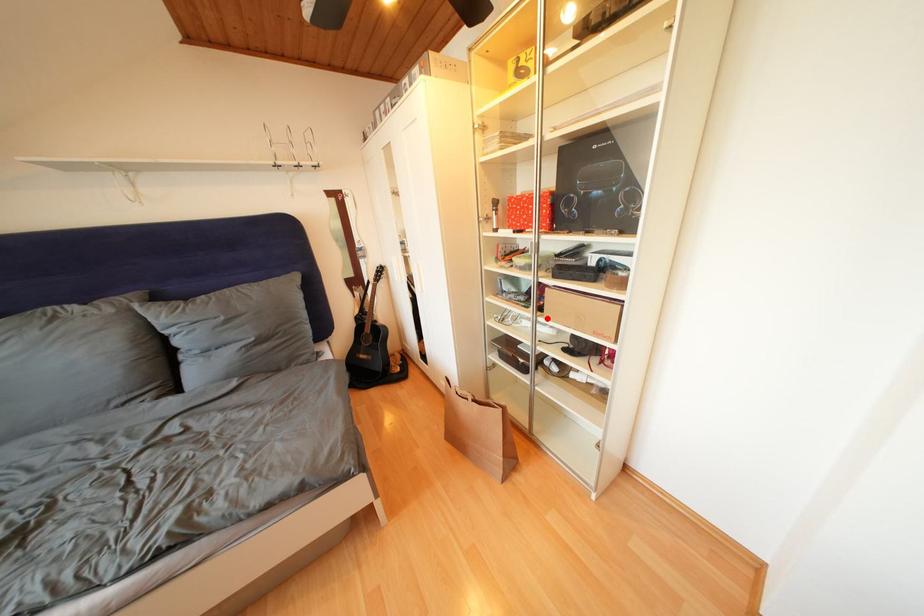
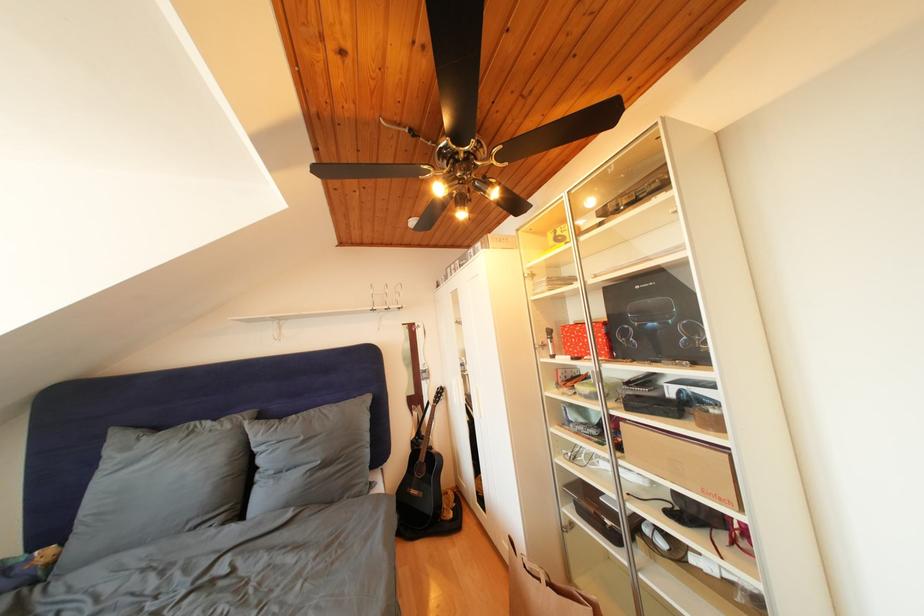
Question: I am providing you with two images of the same scene from different viewpoints. A red point is marked on the first image. Can you still see the location of the red point in image 2?

Choices:
 (A) Yes
 (B) No

Answer: (A)